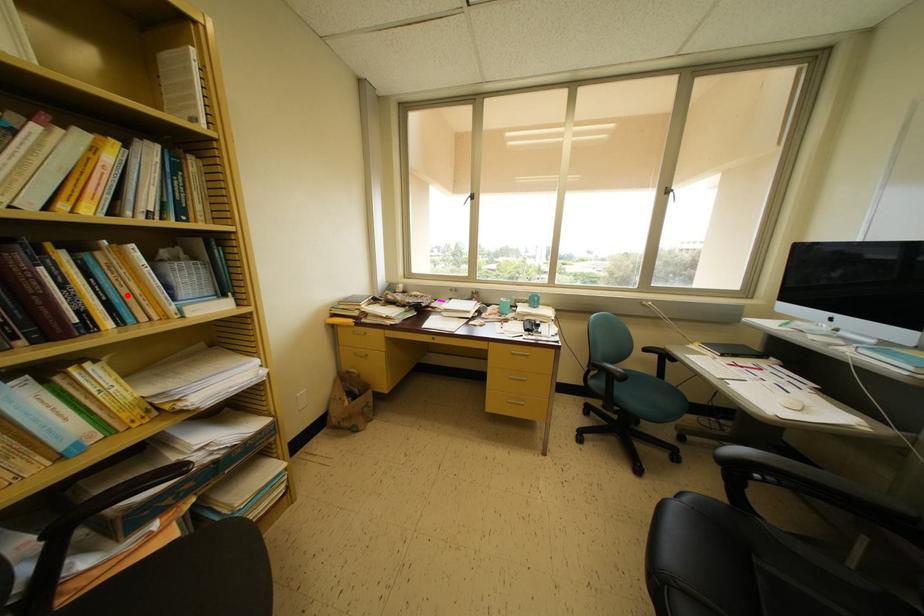
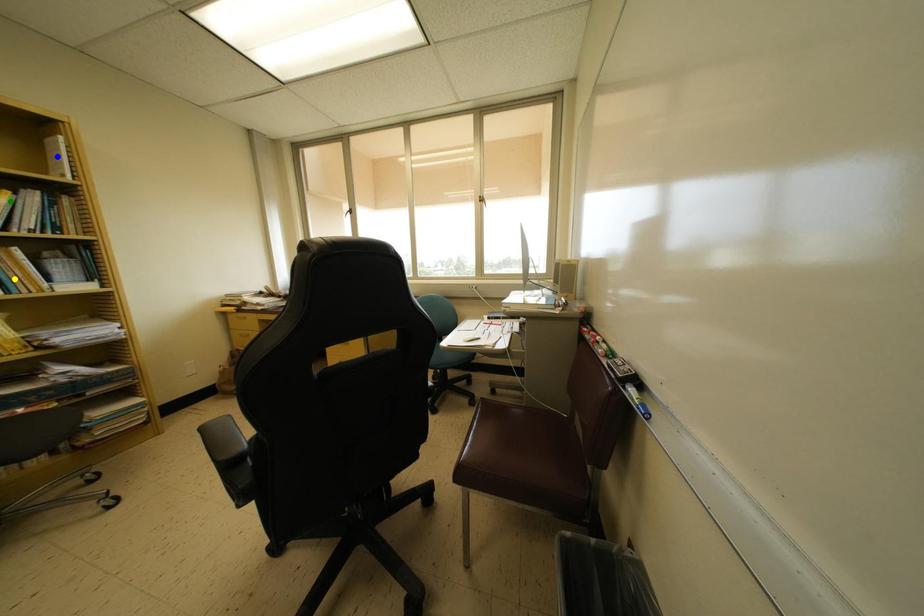
Question: I am providing you with two images of the same scene from different viewpoints. A red point is marked on the first image. You are given multiple points on the second image. Can you choose the point in image 2 that corresponds to the point in image 1?

Choices:
 (A) green point
 (B) blue point
 (C) yellow point

Answer: (C)